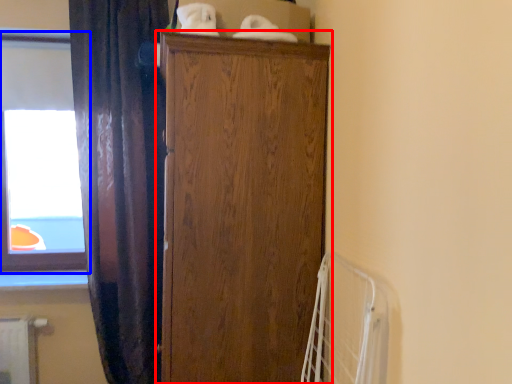
Question: Which point is closer to the camera, cupboard (highlighted by a red box) or window (highlighted by a blue box)?

Choices:
 (A) cupboard
 (B) window

Answer: (A)